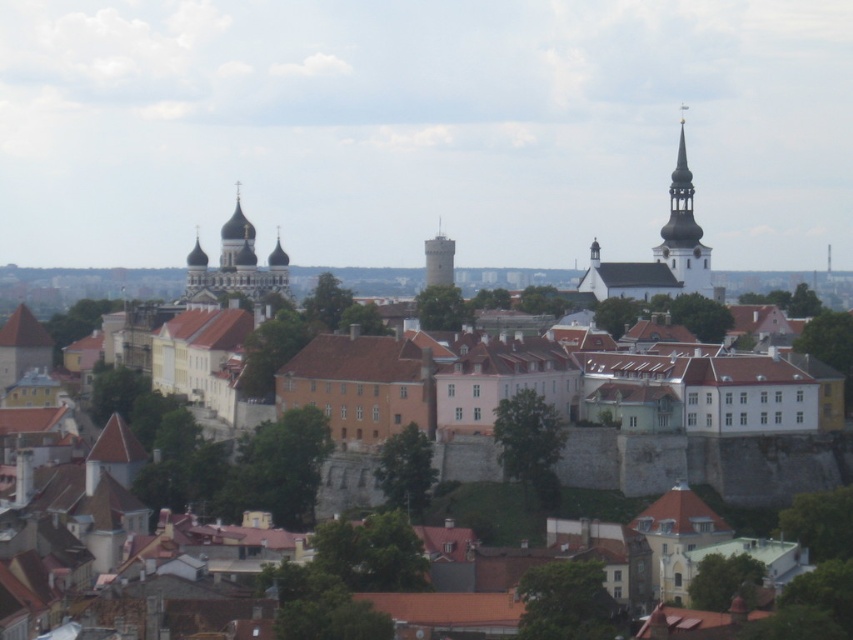
Question: Can you confirm if dark gray stone tower at center-left is positioned above smooth white tower at center?

Choices:
 (A) yes
 (B) no

Answer: (B)

Question: Is the position of dark gray stone tower at center-left less distant than that of smooth white tower at center?

Choices:
 (A) no
 (B) yes

Answer: (B)

Question: Does dark gray stone tower at center-left come in front of white smooth steeple at upper right?

Choices:
 (A) no
 (B) yes

Answer: (B)

Question: Considering the real-world distances, which object is closest to the white smooth steeple at upper right?

Choices:
 (A) smooth white tower at center
 (B) dark gray stone tower at center-left

Answer: (A)

Question: Among these objects, which one is farthest from the camera?

Choices:
 (A) dark gray stone tower at center-left
 (B) smooth white tower at center
 (C) white smooth steeple at upper right

Answer: (C)

Question: Among these points, which one is farthest from the camera?

Choices:
 (A) (190, 285)
 (B) (682, 128)

Answer: (B)